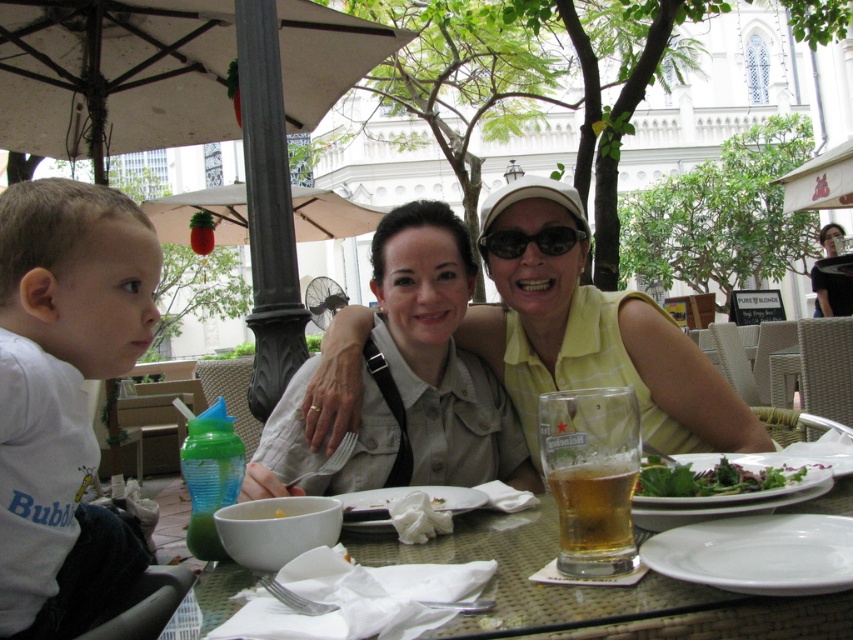
Question: Can you confirm if white cotton shirt at left is wider than white ceramic plate at lower right?

Choices:
 (A) yes
 (B) no

Answer: (A)

Question: Among these points, which one is nearest to the camera?

Choices:
 (A) (149, 248)
 (B) (546, 472)
 (C) (790, 472)
 (D) (456, 308)

Answer: (B)

Question: Which of the following is the farthest from the observer?

Choices:
 (A) (561, 481)
 (B) (757, 481)

Answer: (B)

Question: Is white cotton shirt at left behind black plastic sunglasses at center?

Choices:
 (A) yes
 (B) no

Answer: (B)

Question: In this image, where is matte yellow shirt at center located relative to light beige denim jacket at center?

Choices:
 (A) right
 (B) left

Answer: (A)

Question: Considering the real-world distances, which object is farthest from the clear glass table at center?

Choices:
 (A) matte yellow shirt at center
 (B) black plastic sunglasses at center
 (C) white ceramic plate at lower right
 (D) translucent glass beer at center

Answer: (B)